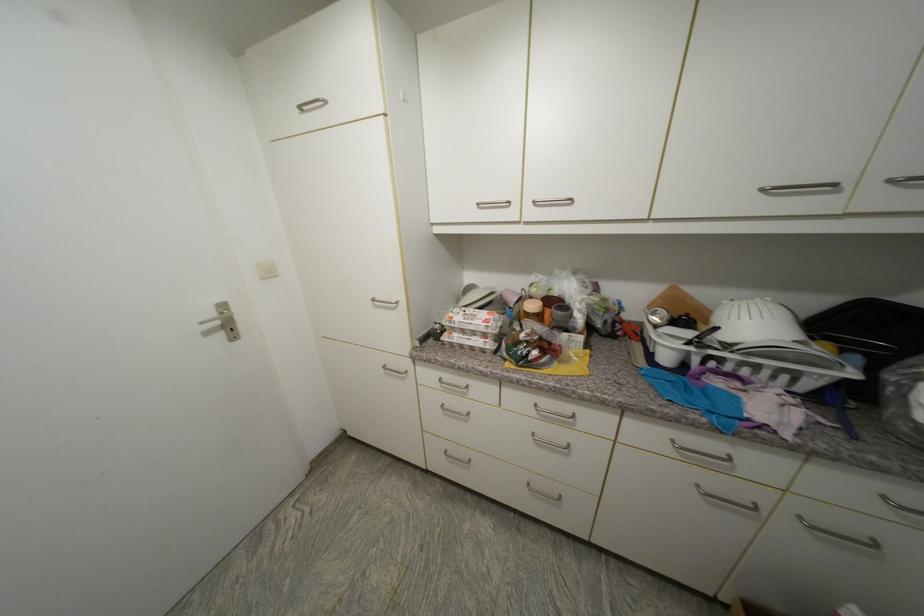
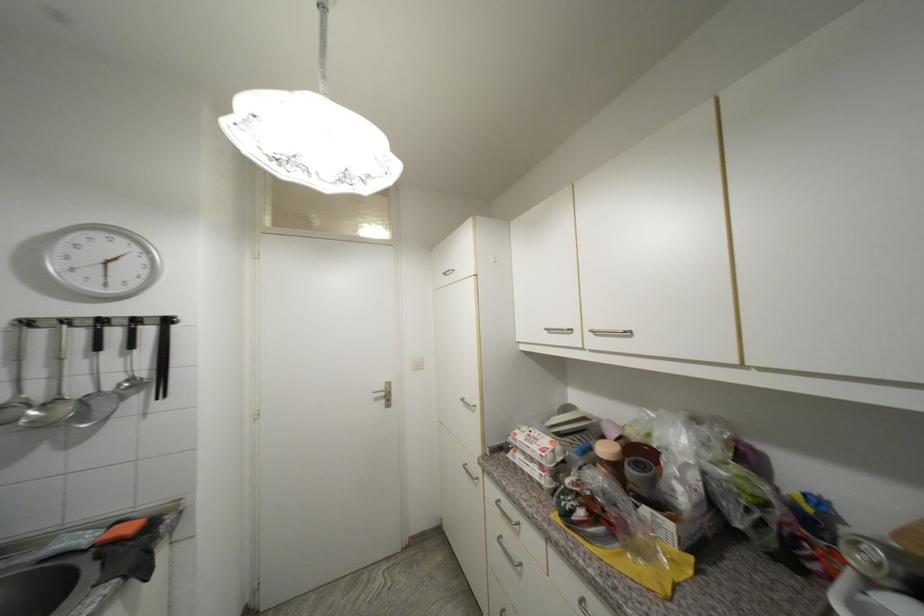
Where in the second image is the point corresponding to (545,318) from the first image?

(622, 469)